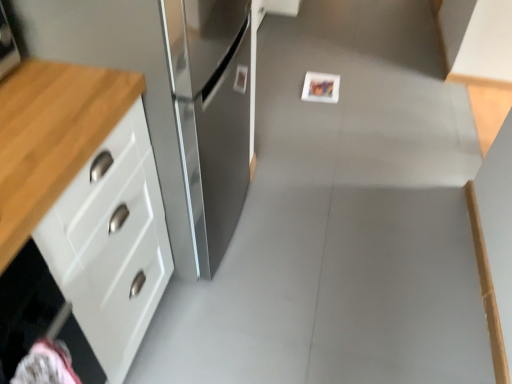
Image resolution: width=512 pixels, height=384 pixels. Describe the element at coordinates (170, 99) in the screenshot. I see `stainless steel refrigerator at left` at that location.

Where is `stainless steel refrigerator at left`? stainless steel refrigerator at left is located at coordinates click(x=170, y=99).

Find the location of `stainless steel refrigerator at left`. stainless steel refrigerator at left is located at coordinates (170, 99).